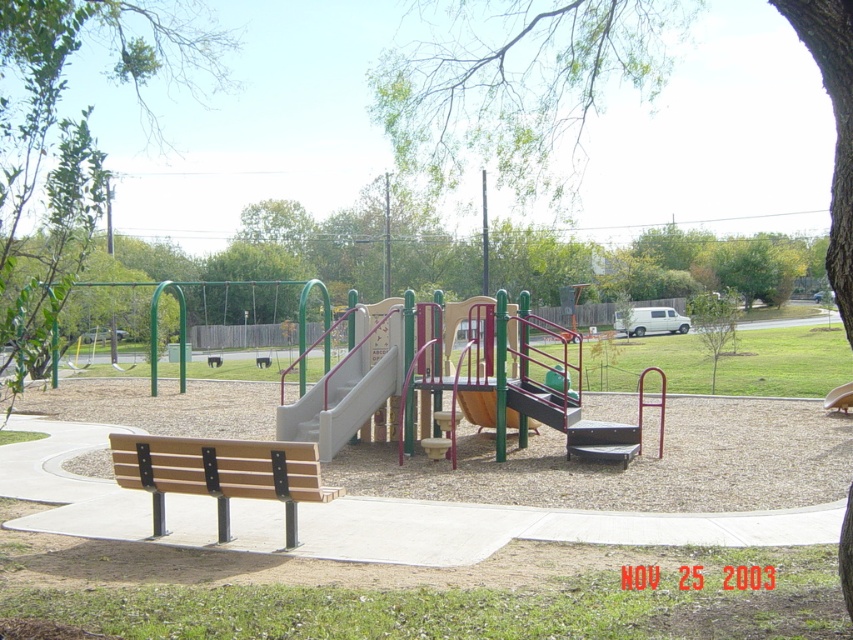
You are a parent waiting on the wooden bench at lower left while your child plays on the white plastic slide at center. Can you see the entire slide from where you are sitting?

The wooden bench at lower left is in front of the white plastic slide at center, so the slide is behind the bench. Therefore, you cannot see the entire slide from where you are sitting.

You are standing on the concrete pathway near the wooden bench with black metal supports. You want to take a photo of the playground equipment while avoiding the green leafy tree at upper center in the background. Based on your current position, which direction should you move to ensure the tree is not in the frame?

Move to the left or right to avoid the green leafy tree at upper center located at point (514, 77).